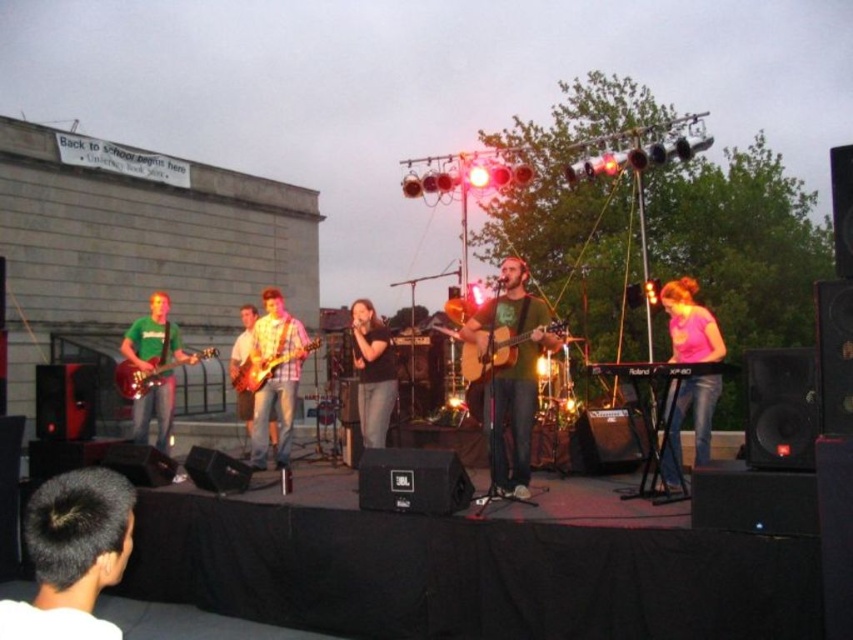
You are a photographer standing behind the stage. You want to take a photo of the plaid shirt at center and the matte wood guitar at center. Can you fit both in your camera frame if your camera has a maximum horizontal field of view of 10 feet?

The plaid shirt at center and matte wood guitar at center are 8.77 feet apart, so yes, they can both fit within the camera frame since the distance between them is less than the maximum horizontal field of view of 10 feet.

You are a photographer at the live music performance. You want to capture a closeup shot of the wooden electric guitar at center without including the plaid shirt at center in the frame. Is this possible given their sizes?

The plaid shirt at center has a larger width than the wooden electric guitar at center. Since the plaid shirt is wider, it might block the view of the guitar if they are positioned closely together. To capture the guitar without the shirt, you would need to adjust your angle or move closer to isolate the guitar in the frame.

You are a photographer standing at the front of the stage during the live music performance. You want to take a photo that includes both the keyboardist and one of the guitarists. The keyboardist is at point (85, 476) and the guitarist is at point (254, 358). Which musician is closer to you so that you can focus on them first?

The keyboardist at point (85, 476) is closer to you, so you can focus on them first since they are nearer than the guitarist at point (254, 358).